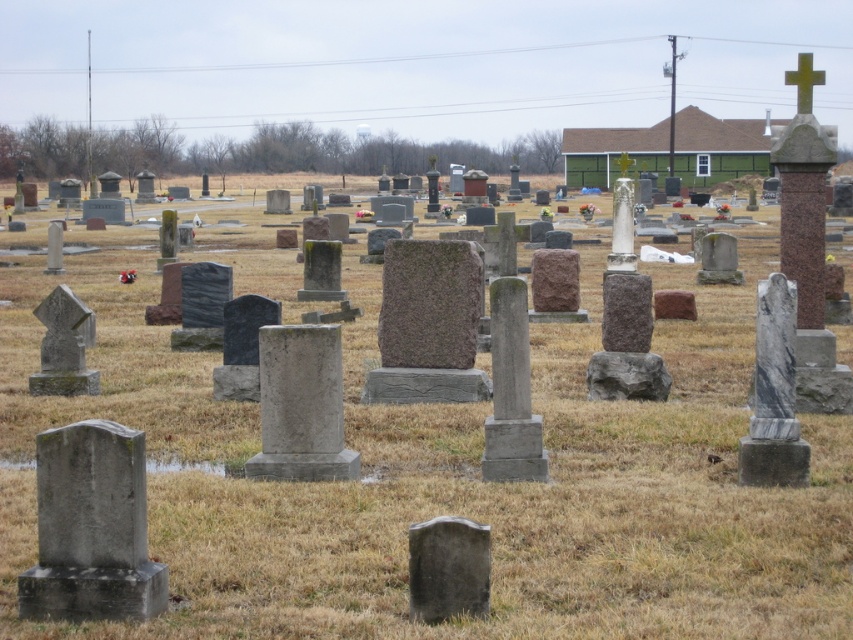
Does point (355, 280) come farther from viewer compared to point (482, 577)?

Yes, point (355, 280) is behind point (482, 577).

Is brown dry grass at center wider than smooth gray stone at center?

Indeed, brown dry grass at center has a greater width compared to smooth gray stone at center.

Identify the location of brown dry grass at center. This screenshot has width=853, height=640. pyautogui.click(x=450, y=481).

Can you confirm if brown dry grass at center is thinner than green polished stone cross at upper right?

Correct, brown dry grass at center's width is less than green polished stone cross at upper right's.

Is point (142, 355) more distant than point (801, 97)?

That is True.

Identify the location of brown dry grass at center. (450, 481).

Is smooth gray stone at center to the right of green polished stone cross at upper right from the viewer's perspective?

In fact, smooth gray stone at center is to the left of green polished stone cross at upper right.

The height and width of the screenshot is (640, 853). I want to click on smooth gray stone at center, so click(x=447, y=568).